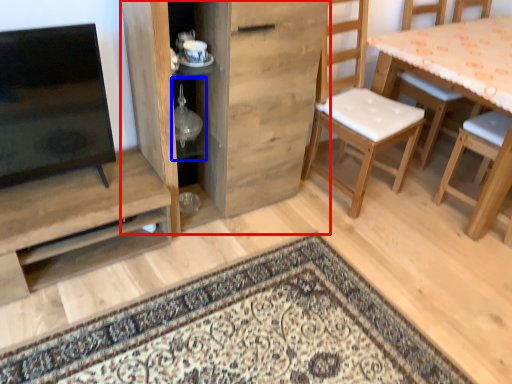
Question: Which object appears farthest to the camera in this image, cabinetry (highlighted by a red box) or shelf (highlighted by a blue box)?

Choices:
 (A) cabinetry
 (B) shelf

Answer: (B)